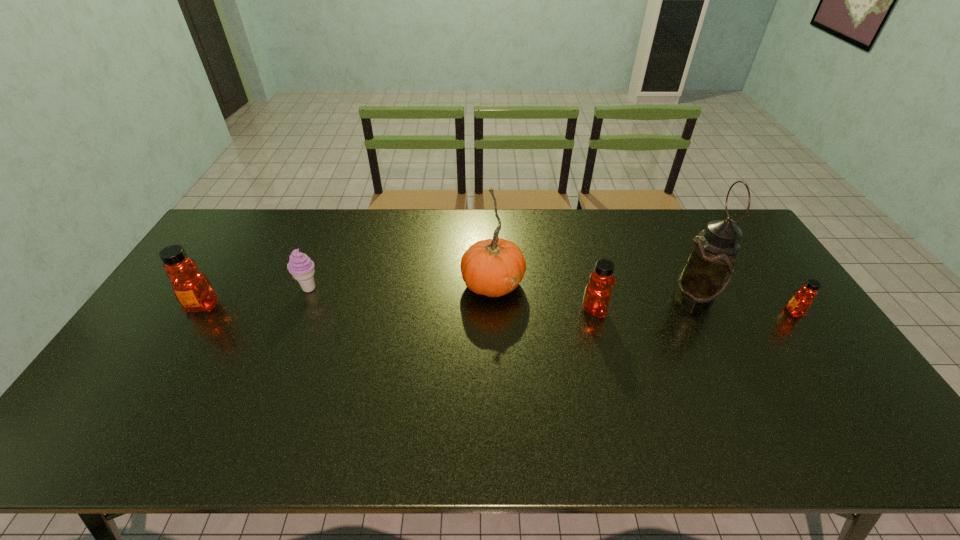
This screenshot has width=960, height=540. In order to click on free space located 0.230m on the front label of the leftmost object in this screenshot , I will do (153, 386).

The image size is (960, 540). I want to click on blank space located on the front label of the second shortest honey, so click(733, 310).

Where is `free space located on the front label of the rightmost object`? The image size is (960, 540). free space located on the front label of the rightmost object is located at coordinates (652, 312).

This screenshot has width=960, height=540. I want to click on vacant region located on the front label of the rightmost object, so click(673, 312).

Where is `vacant space positioned 0.320m on the front label of the rightmost object`? vacant space positioned 0.320m on the front label of the rightmost object is located at coordinates (676, 312).

Where is `vacant space located 0.220m on the front of the fifth shortest object`? This screenshot has height=540, width=960. vacant space located 0.220m on the front of the fifth shortest object is located at coordinates (495, 369).

At what (x,y) coordinates should I click in order to perform the action: click on vacant space located 0.070m on the front of the icecream. Please return your answer as a coordinate pair (x, y). The width and height of the screenshot is (960, 540). Looking at the image, I should click on (299, 314).

Find the location of a particular element. This screenshot has height=540, width=960. vacant space located 0.070m on the right of the oil lamp is located at coordinates (739, 296).

The image size is (960, 540). What are the coordinates of `object present at the left edge` in the screenshot? It's located at (192, 288).

In order to click on object that is at the right edge in this screenshot , I will do `click(799, 304)`.